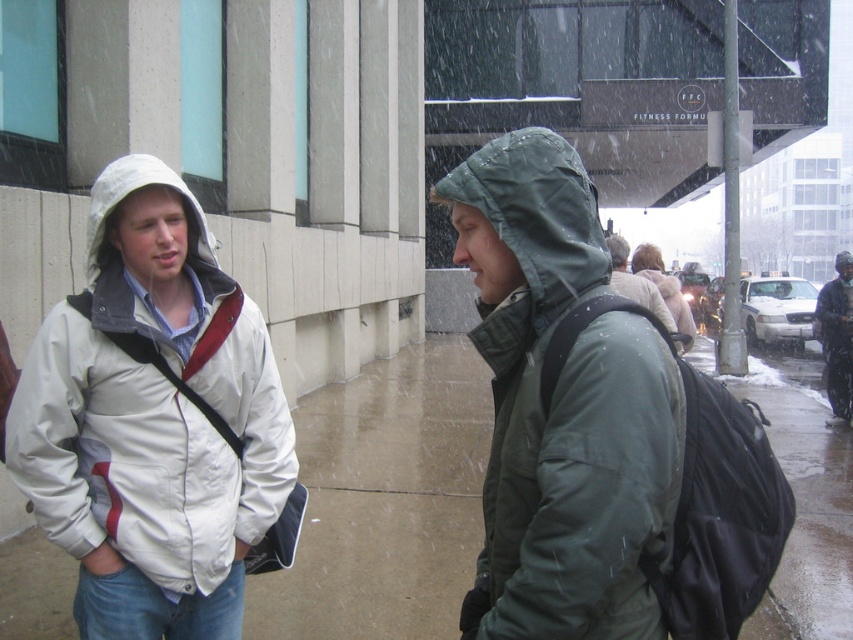
Question: Which point is farther to the camera?

Choices:
 (A) (61, 426)
 (B) (624, 282)
 (C) (560, 221)

Answer: (B)

Question: Is brown concrete pavement at center above dark gray hooded jacket at right?

Choices:
 (A) yes
 (B) no

Answer: (B)

Question: Can you confirm if white matte jacket at left is thinner than light beige wool coat at center?

Choices:
 (A) no
 (B) yes

Answer: (B)

Question: Among these objects, which one is farthest from the camera?

Choices:
 (A) green matte jacket at center
 (B) white matte jacket at left
 (C) light gray woolen jacket at center
 (D) dark gray hooded jacket at right

Answer: (D)

Question: Among these objects, which one is farthest from the camera?

Choices:
 (A) white matte jacket at left
 (B) brown concrete pavement at center
 (C) light beige wool coat at center
 (D) green matte jacket at center

Answer: (C)

Question: Is light beige wool coat at center bigger than light gray woolen jacket at center?

Choices:
 (A) no
 (B) yes

Answer: (B)